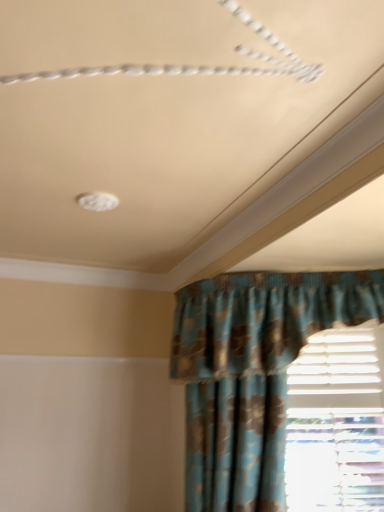
This screenshot has height=512, width=384. What do you see at coordinates (337, 423) in the screenshot?
I see `white plastic blinds at lower right` at bounding box center [337, 423].

The height and width of the screenshot is (512, 384). In order to click on white plastic blinds at lower right in this screenshot , I will do click(x=337, y=423).

In order to face white plastic blinds at lower right, should I rotate leftwards or rightwards?

A 16.665 degree turn to the right will do.

Describe the element at coordinates (252, 373) in the screenshot. I see `blue textured fabric curtain at lower right` at that location.

At what (x,y) coordinates should I click in order to perform the action: click on blue textured fabric curtain at lower right. Please return your answer as a coordinate pair (x, y). Looking at the image, I should click on (252, 373).

In order to click on white plastic blinds at lower right in this screenshot , I will do `click(337, 423)`.

Considering the relative positions of white plastic blinds at lower right and blue textured fabric curtain at lower right in the image provided, is white plastic blinds at lower right to the left of blue textured fabric curtain at lower right from the viewer's perspective?

Incorrect, white plastic blinds at lower right is not on the left side of blue textured fabric curtain at lower right.

In the scene shown: Is white plastic blinds at lower right in front of or behind blue textured fabric curtain at lower right in the image?

In the image, white plastic blinds at lower right appears behind blue textured fabric curtain at lower right.

Which is less distant, [286,452] or [220,361]?

The point [220,361] is closer to the camera.

From the image's perspective, is white plastic blinds at lower right beneath blue textured fabric curtain at lower right?

Correct, white plastic blinds at lower right appears lower than blue textured fabric curtain at lower right in the image.

From a real-world perspective, is white plastic blinds at lower right physically below blue textured fabric curtain at lower right?

Yes, from a real-world perspective, white plastic blinds at lower right is under blue textured fabric curtain at lower right.

Is white plastic blinds at lower right wider or thinner than blue textured fabric curtain at lower right?

In the image, white plastic blinds at lower right appears to be more narrow than blue textured fabric curtain at lower right.

From their relative heights in the image, would you say white plastic blinds at lower right is taller or shorter than blue textured fabric curtain at lower right?

white plastic blinds at lower right is shorter than blue textured fabric curtain at lower right.

Based on the photo, looking at the image, does white plastic blinds at lower right seem bigger or smaller compared to blue textured fabric curtain at lower right?

Clearly, white plastic blinds at lower right is smaller in size than blue textured fabric curtain at lower right.

Is blue textured fabric curtain at lower right surrounded by white plastic blinds at lower right?

Definitely not — blue textured fabric curtain at lower right is not inside white plastic blinds at lower right.

Is white plastic blinds at lower right far away from blue textured fabric curtain at lower right?

No, white plastic blinds at lower right is in close proximity to blue textured fabric curtain at lower right.

Is white plastic blinds at lower right oriented away from blue textured fabric curtain at lower right?

white plastic blinds at lower right is not turned away from blue textured fabric curtain at lower right.

Consider the image. Can you tell me how much white plastic blinds at lower right and blue textured fabric curtain at lower right differ in facing direction?

62.9 degrees separate the facing orientations of white plastic blinds at lower right and blue textured fabric curtain at lower right.

Identify the location of curtain located above the white plastic blinds at lower right (from the image's perspective). (252, 373).

Which is more to the left, blue textured fabric curtain at lower right or white plastic blinds at lower right?

From the viewer's perspective, blue textured fabric curtain at lower right appears more on the left side.

Is blue textured fabric curtain at lower right in front of white plastic blinds at lower right?

Yes.

Does point (274, 426) lie behind point (308, 374)?

That is False.

From the image's perspective, between blue textured fabric curtain at lower right and white plastic blinds at lower right, which one is located above?

blue textured fabric curtain at lower right is shown above in the image.

From a real-world perspective, is blue textured fabric curtain at lower right located beneath white plastic blinds at lower right?

No, from a real-world perspective, blue textured fabric curtain at lower right is not below white plastic blinds at lower right.

Looking at their sizes, would you say blue textured fabric curtain at lower right is wider or thinner than white plastic blinds at lower right?

Clearly, blue textured fabric curtain at lower right has more width compared to white plastic blinds at lower right.

Can you confirm if blue textured fabric curtain at lower right is taller than white plastic blinds at lower right?

Correct, blue textured fabric curtain at lower right is much taller as white plastic blinds at lower right.

Considering the sizes of objects blue textured fabric curtain at lower right and white plastic blinds at lower right in the image provided, who is bigger, blue textured fabric curtain at lower right or white plastic blinds at lower right?

blue textured fabric curtain at lower right.

Is blue textured fabric curtain at lower right positioned beyond the bounds of white plastic blinds at lower right?

blue textured fabric curtain at lower right is positioned outside white plastic blinds at lower right.

Is blue textured fabric curtain at lower right positioned far away from white plastic blinds at lower right?

No, blue textured fabric curtain at lower right is not far away from white plastic blinds at lower right.

Is blue textured fabric curtain at lower right oriented away from white plastic blinds at lower right?

Yes.

What's the angular difference between blue textured fabric curtain at lower right and white plastic blinds at lower right's facing directions?

The angular difference between blue textured fabric curtain at lower right and white plastic blinds at lower right is 62.9 degrees.

The width and height of the screenshot is (384, 512). Identify the location of curtain in front of the white plastic blinds at lower right. (252, 373).

The image size is (384, 512). What are the coordinates of `window below the blue textured fabric curtain at lower right (from a real-world perspective)` in the screenshot? It's located at (337, 423).

Find the location of a particular element. The image size is (384, 512). curtain located on the left of white plastic blinds at lower right is located at coordinates (252, 373).